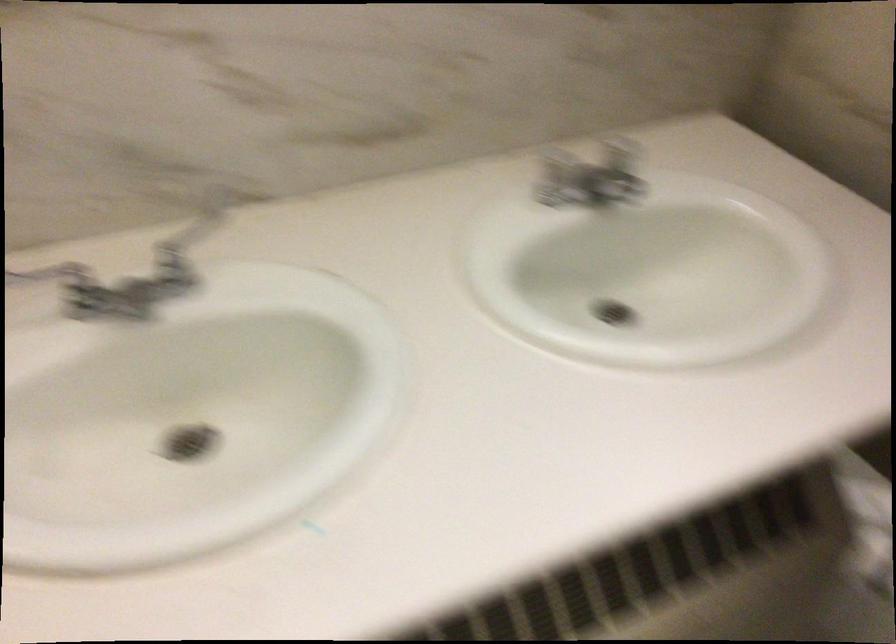
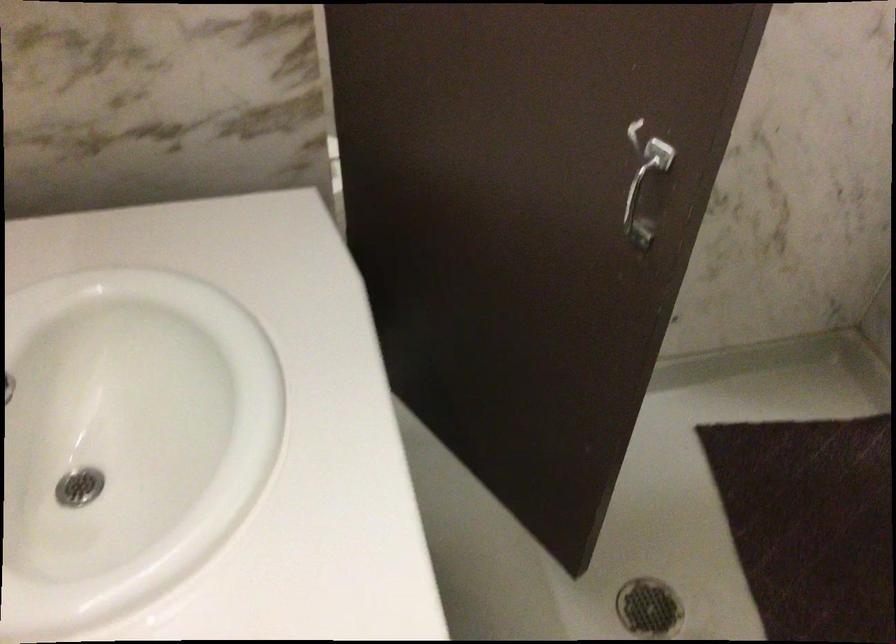
How did the camera likely rotate?

The camera's rotation is toward right-down.